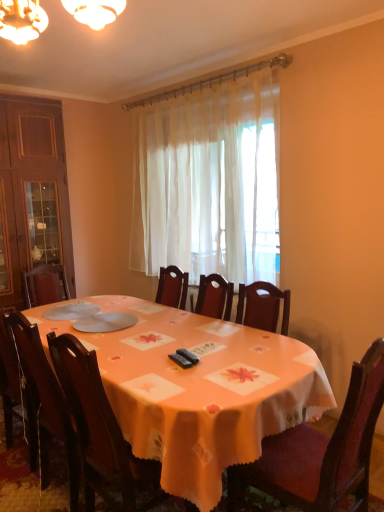
Locate an element on the screen. vacant area on top of white matte plates at center (from a real-world perspective) is located at coordinates (74, 309).